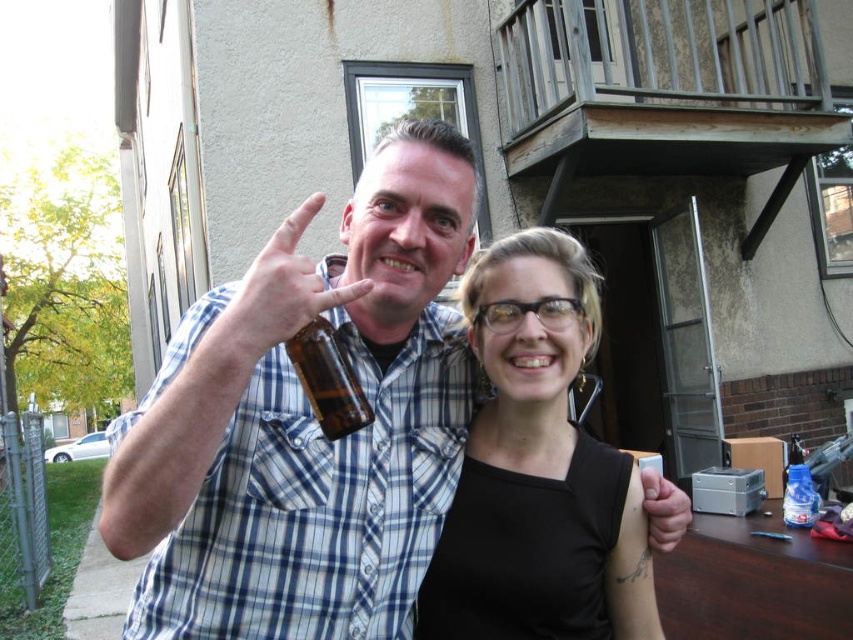
Is point (311, 301) closer to viewer compared to point (660, 531)?

Yes, it is in front of point (660, 531).

Can you confirm if matte glass beer bottle at center is positioned to the right of matte black hand at center?

Incorrect, matte glass beer bottle at center is not on the right side of matte black hand at center.

Is point (274, 289) positioned after point (685, 500)?

No, it is not.

Find the location of a particular element. matte glass beer bottle at center is located at coordinates (277, 292).

Can you confirm if black matte tank top at center is positioned to the left of matte glass beer bottle at center?

Incorrect, black matte tank top at center is not on the left side of matte glass beer bottle at center.

Consider the image. Is black matte tank top at center wider than matte glass beer bottle at center?

Indeed, black matte tank top at center has a greater width compared to matte glass beer bottle at center.

Is point (485, 406) in front of point (297, 221)?

No, (485, 406) is further to viewer.

Image resolution: width=853 pixels, height=640 pixels. I want to click on black matte tank top at center, so click(537, 470).

Does brown glass bottle at center have a smaller size compared to matte black hand at center?

Correct, brown glass bottle at center occupies less space than matte black hand at center.

Where is `brown glass bottle at center`? This screenshot has height=640, width=853. brown glass bottle at center is located at coordinates (328, 378).